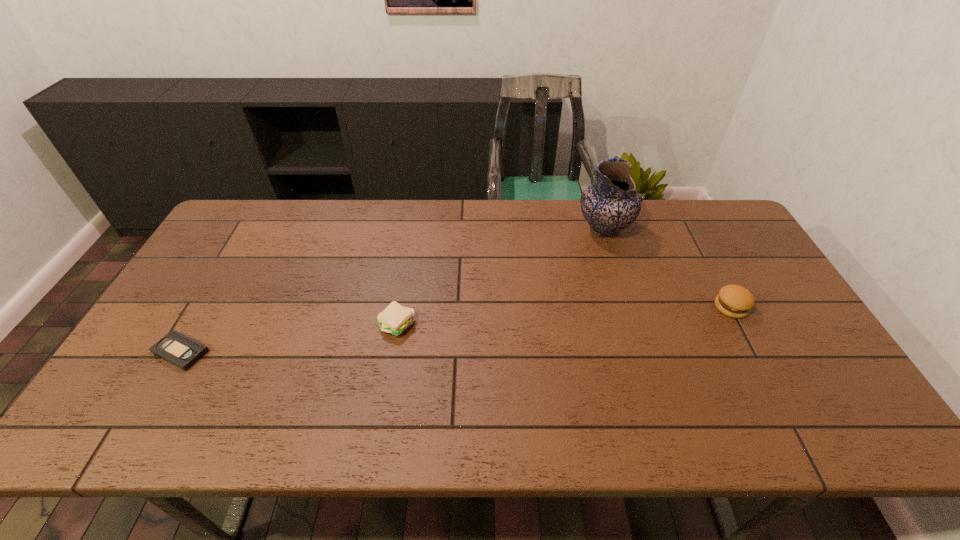
Locate an element on the screen. The width and height of the screenshot is (960, 540). vacant space positioned on the left of the second shortest object is located at coordinates (348, 326).

Where is `free space located 0.150m on the right of the videotape`? The height and width of the screenshot is (540, 960). free space located 0.150m on the right of the videotape is located at coordinates (268, 352).

Where is `object that is at the far edge`? object that is at the far edge is located at coordinates (611, 204).

The height and width of the screenshot is (540, 960). In order to click on object positioned at the left edge in this screenshot , I will do `click(183, 352)`.

You are a GUI agent. You are given a task and a screenshot of the screen. Output one action in this format:
    pyautogui.click(x=<x>, y=<y>)
    Task: Click on the object that is at the right edge
    The height and width of the screenshot is (540, 960).
    Given the screenshot: What is the action you would take?
    pyautogui.click(x=735, y=301)

Where is `blank space at the far edge of the desktop`? blank space at the far edge of the desktop is located at coordinates (604, 239).

The height and width of the screenshot is (540, 960). In order to click on free space at the near edge of the desktop in this screenshot , I will do `click(476, 433)`.

This screenshot has width=960, height=540. I want to click on vacant space at the left edge, so click(x=188, y=302).

I want to click on free region at the right edge of the desktop, so coord(787,398).

In the image, there is a desktop. Identify the location of vacant area at the far left corner. (266, 217).